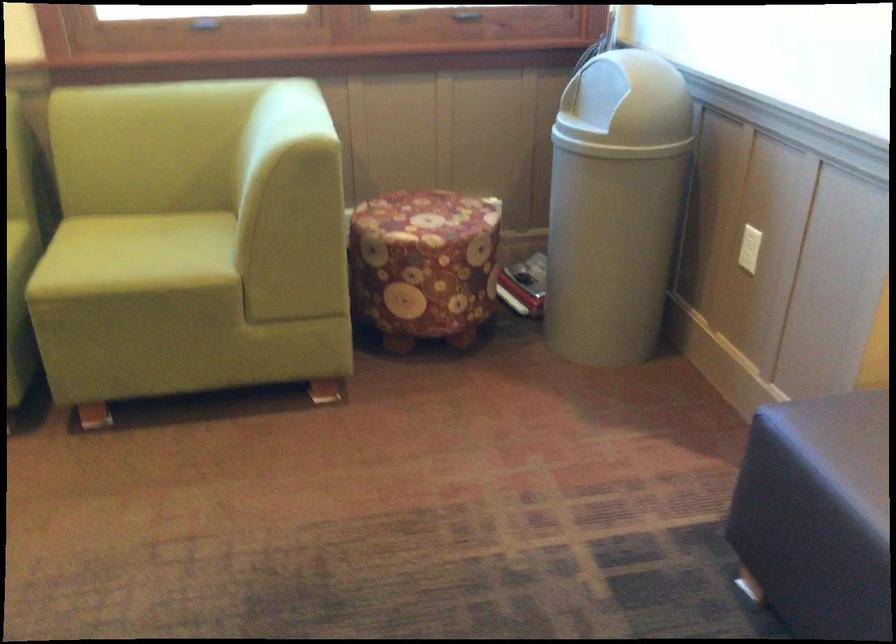
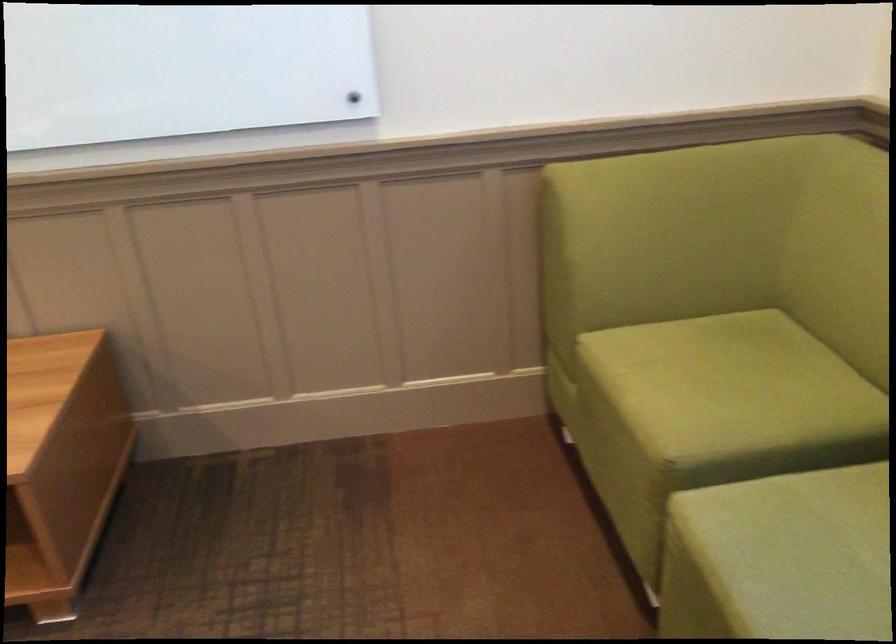
Find the pixel in the second image that matches point (108, 275) in the first image.

(780, 558)